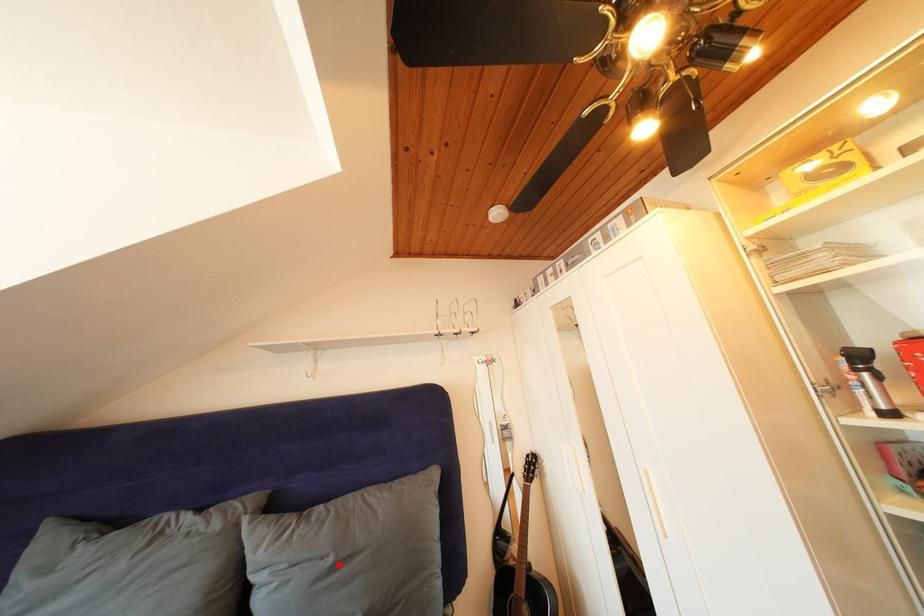
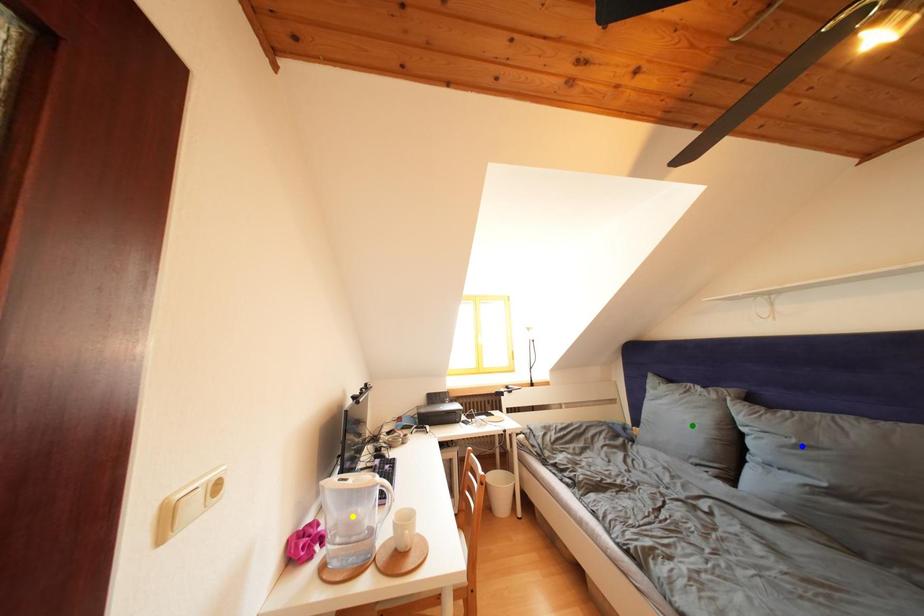
Question: I am providing you with two images of the same scene from different viewpoints. A red point is marked on the first image. You are given multiple points on the second image. Which point in image 2 represents the same 3d spot as the red point in image 1?

Choices:
 (A) blue point
 (B) yellow point
 (C) green point

Answer: (A)